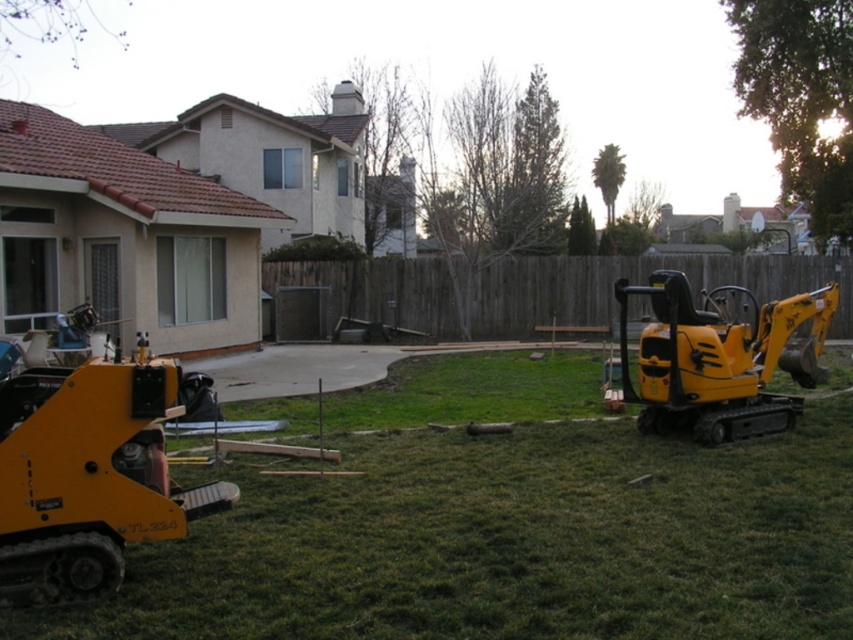
Question: Does green grass at lower center lie behind yellow rubber excavator at right?

Choices:
 (A) no
 (B) yes

Answer: (A)

Question: From the image, what is the correct spatial relationship of yellow rubber tracked excavator at lower left in relation to yellow rubber excavator at right?

Choices:
 (A) above
 (B) below

Answer: (B)

Question: Which of the following is the closest to the observer?

Choices:
 (A) yellow rubber excavator at right
 (B) yellow rubber tracked excavator at lower left
 (C) wooden fence at center
 (D) green grass at lower center

Answer: (D)

Question: Does yellow rubber tracked excavator at lower left lie in front of wooden fence at center?

Choices:
 (A) no
 (B) yes

Answer: (B)

Question: Estimate the real-world distances between objects in this image. Which object is closer to the wooden fence at center?

Choices:
 (A) yellow rubber tracked excavator at lower left
 (B) green grass at lower center

Answer: (B)

Question: Which point is closer to the camera taking this photo?

Choices:
 (A) (581, 298)
 (B) (45, 506)
 (C) (788, 304)
 (D) (22, 625)

Answer: (D)